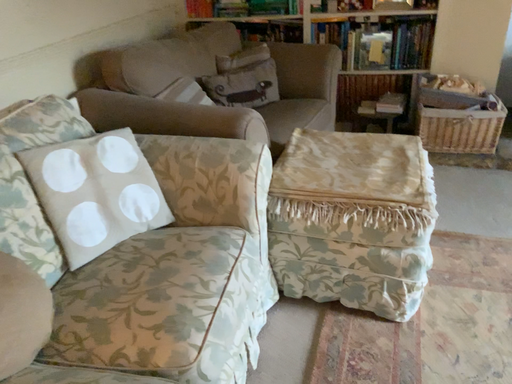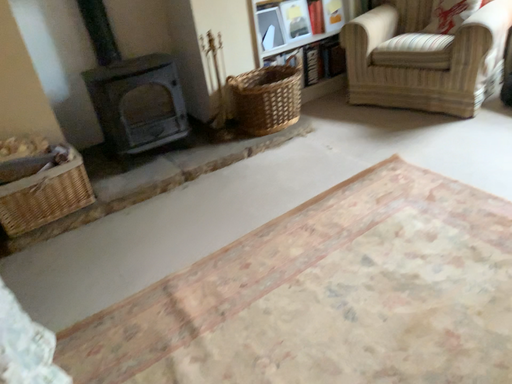
Question: How did the camera likely rotate when shooting the video?

Choices:
 (A) rotated upward
 (B) rotated downward

Answer: (A)